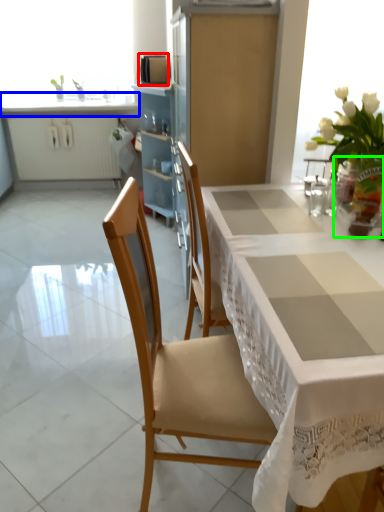
Question: Considering the real-world distances, which object is closest to appliance (highlighted by a red box)? countertop (highlighted by a blue box) or vase (highlighted by a green box).

Choices:
 (A) countertop
 (B) vase

Answer: (A)